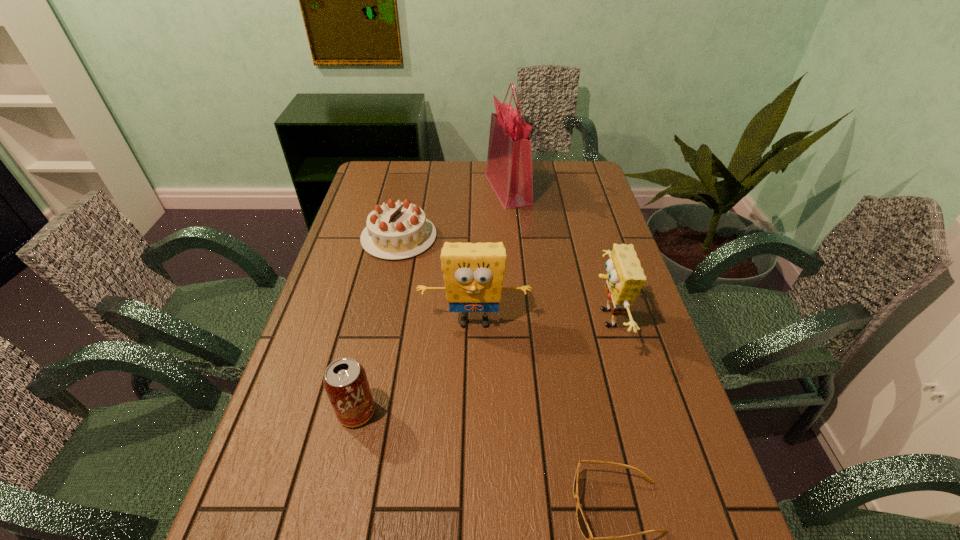
Where is `object that stands as the closest to the left sponge`? This screenshot has height=540, width=960. object that stands as the closest to the left sponge is located at coordinates (625, 278).

Locate which object is the third closest to the second farthest object. Please provide its 2D coordinates. Your answer should be formatted as a tuple, i.e. [(x, y)], where the tuple contains the x and y coordinates of a point satisfying the conditions above.

[(625, 278)]

Where is `free location that satisfies the following two spatial constraints: 1. on the face of the right sponge; 2. on the face of the left sponge`? The width and height of the screenshot is (960, 540). free location that satisfies the following two spatial constraints: 1. on the face of the right sponge; 2. on the face of the left sponge is located at coordinates (606, 322).

What are the coordinates of `blank space that satisfies the following two spatial constraints: 1. on the face of the right sponge; 2. on the face of the left sponge` in the screenshot? It's located at (606, 322).